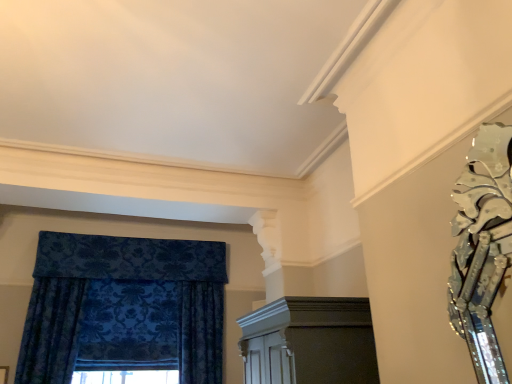
This screenshot has width=512, height=384. I want to click on silver metallic sculpture at upper right, so click(x=482, y=248).

Image resolution: width=512 pixels, height=384 pixels. What do you see at coordinates (482, 248) in the screenshot?
I see `silver metallic sculpture at upper right` at bounding box center [482, 248].

Locate an element on the screen. This screenshot has height=384, width=512. silver metallic sculpture at upper right is located at coordinates (482, 248).